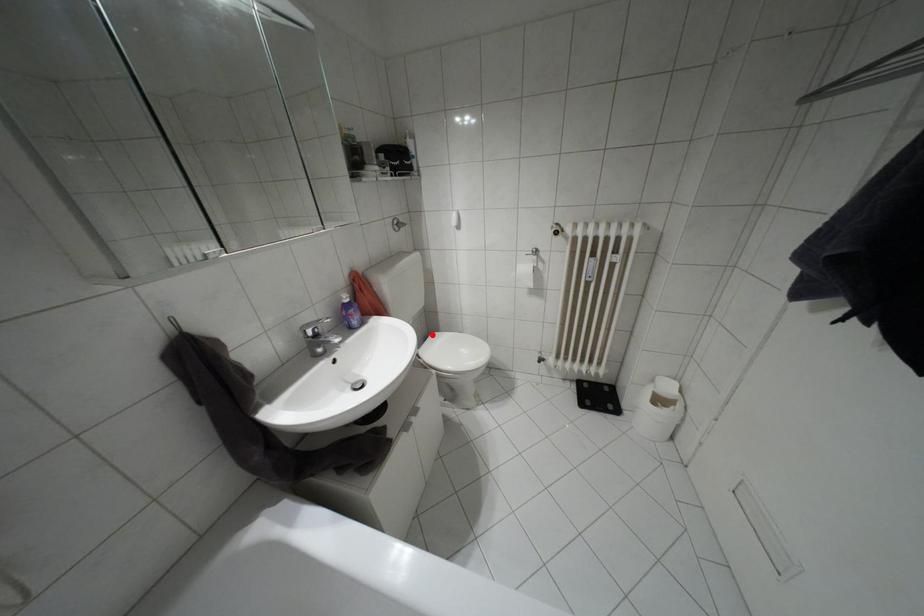
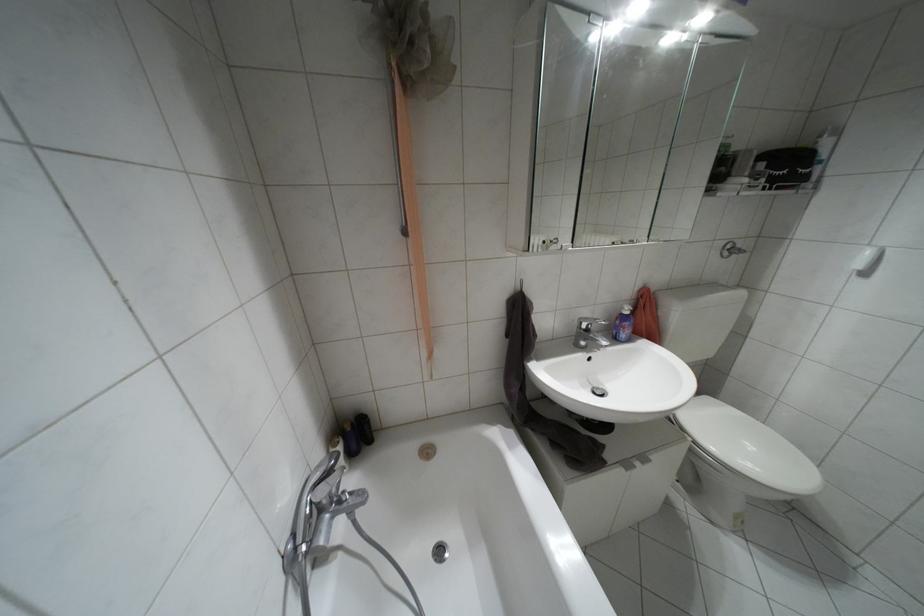
Question: I am providing you with two images of the same scene from different viewpoints. A red point is shown in image1. For the corresponding object point in image2, is it positioned nearer or farther from the camera?

Choices:
 (A) Nearer
 (B) Farther

Answer: (A)